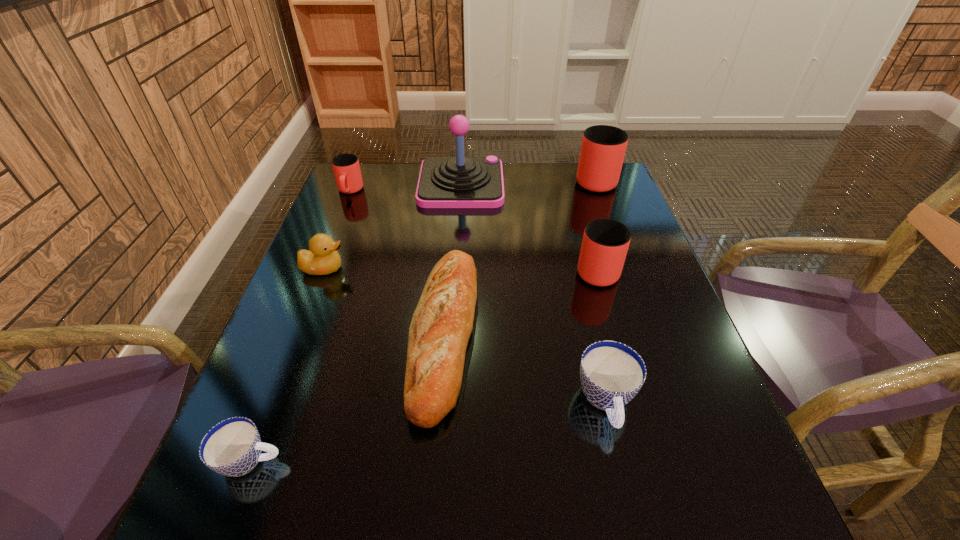
Point out which cup is positioned as the second nearest to the second biggest pink cup. Please provide its 2D coordinates. Your answer should be formatted as a tuple, i.e. [(x, y)], where the tuple contains the x and y coordinates of a point satisfying the conditions above.

[(603, 147)]

The height and width of the screenshot is (540, 960). What are the coordinates of `the fifth closest cup to the duckling` in the screenshot? It's located at (603, 147).

Point out which pink cup is positioned as the second nearest to the right blue cup. Please provide its 2D coordinates. Your answer should be formatted as a tuple, i.e. [(x, y)], where the tuple contains the x and y coordinates of a point satisfying the conditions above.

[(603, 147)]

Select which pink cup is the third closest to the lightbrown baguet. Please provide its 2D coordinates. Your answer should be formatted as a tuple, i.e. [(x, y)], where the tuple contains the x and y coordinates of a point satisfying the conditions above.

[(603, 147)]

In order to click on free location that satisfies the following two spatial constraints: 1. on the handle side of the second tallest cup; 2. forward from the base of the tallest object in this screenshot , I will do `click(572, 185)`.

Locate an element on the screen. The width and height of the screenshot is (960, 540). free space that satisfies the following two spatial constraints: 1. on the handle side of the baguet; 2. on the left side of the smallest pink cup is located at coordinates (294, 333).

Locate an element on the screen. The image size is (960, 540). vacant area in the image that satisfies the following two spatial constraints: 1. facing forward on the duckling; 2. on the handle side of the nearest pink cup is located at coordinates (324, 268).